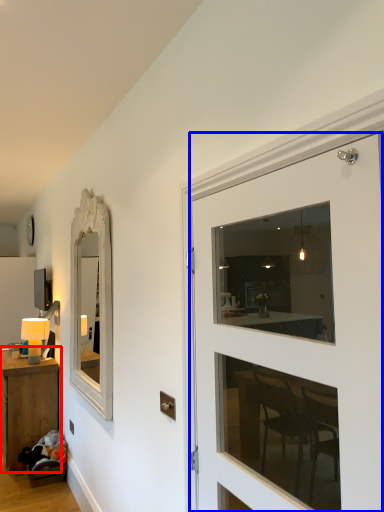
Question: Among these objects, which one is farthest to the camera, table (highlighted by a red box) or door (highlighted by a blue box)?

Choices:
 (A) table
 (B) door

Answer: (A)